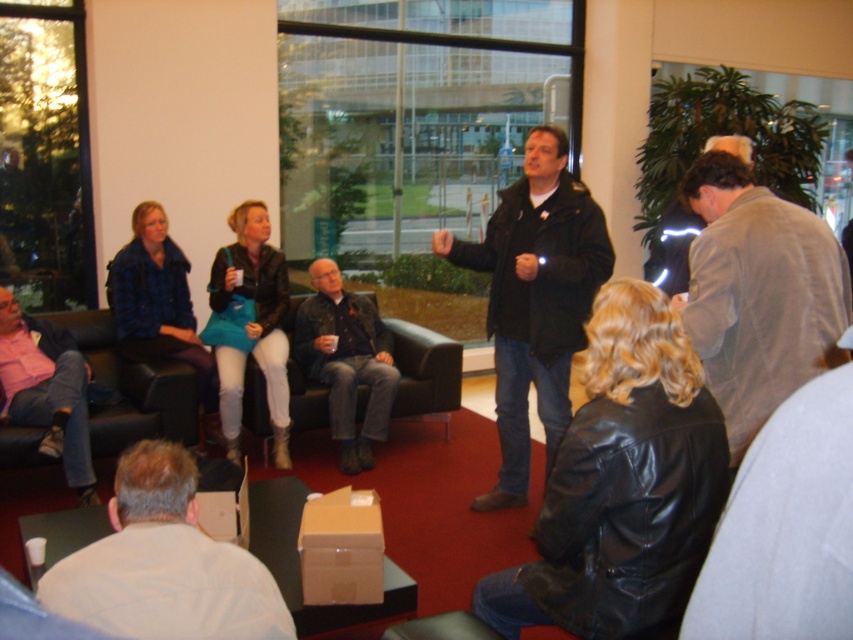
Question: Among these points, which one is nearest to the camera?

Choices:
 (A) click(733, 205)
 (B) click(556, 339)
 (C) click(181, 541)

Answer: (C)

Question: Which point appears farthest from the camera in this image?

Choices:
 (A) pyautogui.click(x=698, y=220)
 (B) pyautogui.click(x=143, y=454)
 (C) pyautogui.click(x=374, y=417)
 (D) pyautogui.click(x=61, y=362)

Answer: (C)

Question: Does denim jacket at center have a greater width compared to pink cotton shirt at lower left?

Choices:
 (A) no
 (B) yes

Answer: (B)

Question: Does gray suede jacket at right appear on the left side of light gray fabric jacket at upper right?

Choices:
 (A) no
 (B) yes

Answer: (B)

Question: Considering the real-world distances, which object is farthest from the denim jacket at center?

Choices:
 (A) white shirt at lower left
 (B) light gray fabric jacket at upper right
 (C) gray suede jacket at right

Answer: (A)

Question: Can you confirm if white shirt at lower left is thinner than light gray fabric jacket at upper right?

Choices:
 (A) no
 (B) yes

Answer: (B)